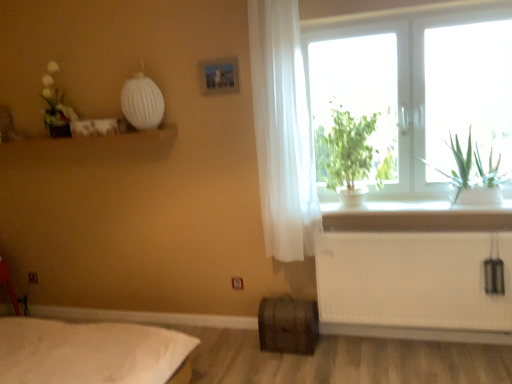
Question: Can you confirm if green leafy plant at window is wider than green leafy plant at window?

Choices:
 (A) yes
 (B) no

Answer: (A)

Question: Is green leafy plant at window completely or partially outside of green leafy plant at window?

Choices:
 (A) no
 (B) yes

Answer: (B)

Question: Is green leafy plant at window positioned far away from green leafy plant at window?

Choices:
 (A) yes
 (B) no

Answer: (B)

Question: Can you confirm if green leafy plant at window is bigger than green leafy plant at window?

Choices:
 (A) yes
 (B) no

Answer: (A)

Question: Does green leafy plant at window lie behind green leafy plant at window?

Choices:
 (A) yes
 (B) no

Answer: (B)

Question: From a real-world perspective, relative to white sheer curtain at right, is green leafy plant at window vertically above or below?

Choices:
 (A) below
 (B) above

Answer: (A)

Question: Which is correct: green leafy plant at window is inside white sheer curtain at right, or outside of it?

Choices:
 (A) outside
 (B) inside

Answer: (A)

Question: From the image's perspective, is green leafy plant at window located above or below white sheer curtain at right?

Choices:
 (A) above
 (B) below

Answer: (B)

Question: Looking at the image, does green leafy plant at window seem bigger or smaller compared to white sheer curtain at right?

Choices:
 (A) small
 (B) big

Answer: (B)

Question: From a real-world perspective, is white sheer curtain at right physically located above or below metallic silver picture frame at upper center?

Choices:
 (A) below
 (B) above

Answer: (A)

Question: Choose the correct answer: Is white sheer curtain at right inside metallic silver picture frame at upper center or outside it?

Choices:
 (A) inside
 (B) outside

Answer: (B)

Question: Considering the positions of white sheer curtain at right and metallic silver picture frame at upper center in the image, is white sheer curtain at right wider or thinner than metallic silver picture frame at upper center?

Choices:
 (A) thin
 (B) wide

Answer: (B)

Question: Looking at the image, does white sheer curtain at right seem bigger or smaller compared to metallic silver picture frame at upper center?

Choices:
 (A) small
 (B) big

Answer: (B)

Question: Considering the relative positions of rustic wooden barrel at lower center and white glass window at upper right in the image provided, is rustic wooden barrel at lower center to the left or to the right of white glass window at upper right?

Choices:
 (A) right
 (B) left

Answer: (B)

Question: From a real-world perspective, is rustic wooden barrel at lower center above or below white glass window at upper right?

Choices:
 (A) below
 (B) above

Answer: (A)